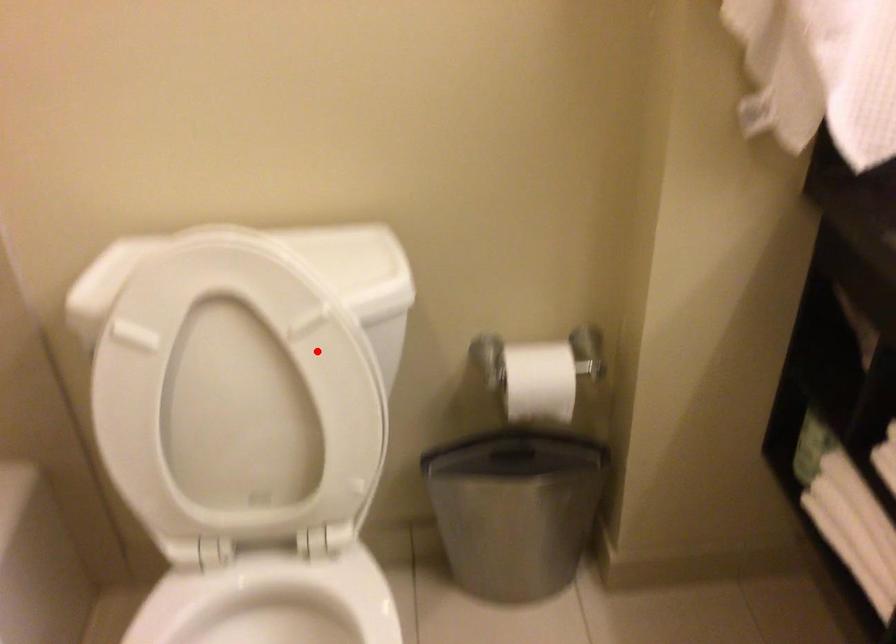
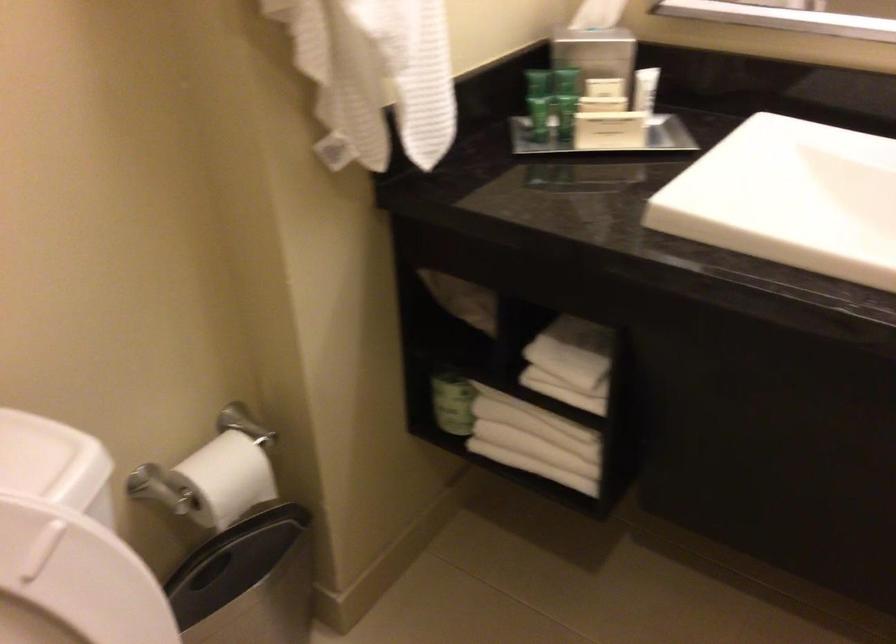
The point at the highlighted location is marked in the first image. Where is the corresponding point in the second image?

(73, 582)